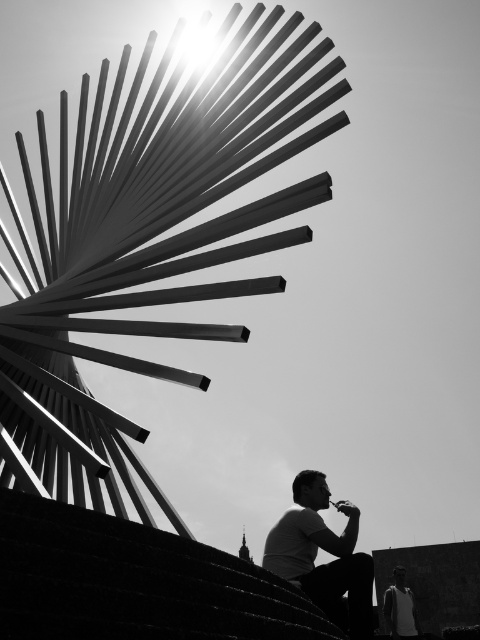
Based on the photo, you are standing at the center of the sculpture looking outward. There is a point at coordinate (325, 563). What object is located at that point?

The point at coordinate (325, 563) is on the white matte shirt at lower right.

You are a photographer trying to capture the sculpture in the center. You notice the white matte tank top at lower right and the transparent plastic cup at lower right in your frame. Which object should you adjust to ensure the sculpture is the main focus, considering their sizes?

The white matte tank top at lower right is wider than the transparent plastic cup at lower right, so adjusting the white matte tank top at lower right would be more effective in ensuring the sculpture remains the main focus.

You are standing in front of the modern sculpture and notice a specific point at coordinates (400, 609). What object is located at this point?

The point at coordinates (400, 609) corresponds to the white matte tank top at lower right.